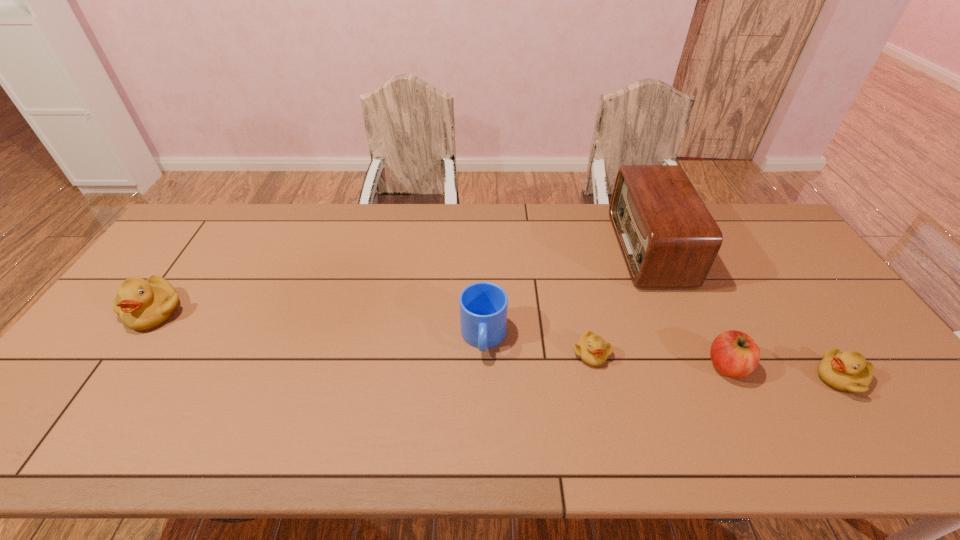
To make them evenly spaced by inserting another duckling among them, please locate a free space for this new duckling. Please provide its 2D coordinates. Your answer should be formatted as a tuple, i.e. [(x, y)], where the tuple contains the x and y coordinates of a point satisfying the conditions above.

[(364, 332)]